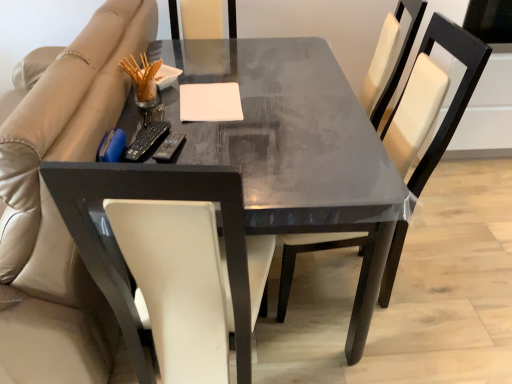
Question: In the image, is white leather chair at center on the left side or the right side of white matte notepad at center?

Choices:
 (A) right
 (B) left

Answer: (A)

Question: Is white leather chair at center inside the boundaries of white matte notepad at center, or outside?

Choices:
 (A) outside
 (B) inside

Answer: (A)

Question: Considering the real-world distances, which object is farthest from the white matte notepad at center?

Choices:
 (A) beige leather couch at left
 (B) black plastic remote at left
 (C) white leather chair at center
 (D) matte black table at center

Answer: (C)

Question: Which of these objects is positioned farthest from the beige leather couch at left?

Choices:
 (A) white matte notepad at center
 (B) matte black table at center
 (C) black plastic remote at left
 (D) white leather chair at center

Answer: (D)